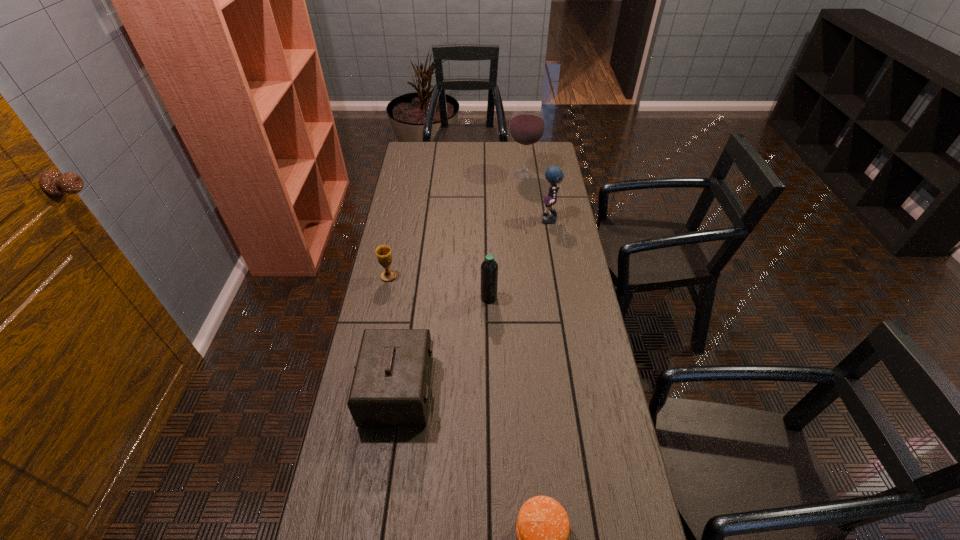
This screenshot has height=540, width=960. In order to click on blank area located 0.060m on the back of the farthest object in this screenshot , I will do `click(521, 159)`.

At what (x,y) coordinates should I click in order to perform the action: click on vacant space situated 0.220m on the front-facing side of the rag doll. Please return your answer as a coordinate pair (x, y). The width and height of the screenshot is (960, 540). Looking at the image, I should click on (489, 221).

Image resolution: width=960 pixels, height=540 pixels. Identify the location of vacant region located on the front-facing side of the rag doll. (526, 221).

Locate an element on the screen. free space located on the front-facing side of the rag doll is located at coordinates (516, 221).

Locate an element on the screen. The image size is (960, 540). free region located on the back of the fourth object from right to left is located at coordinates (489, 270).

Image resolution: width=960 pixels, height=540 pixels. In order to click on vacant region located 0.110m on the back of the second nearest object in this screenshot , I will do `click(407, 329)`.

Where is `vacant space located 0.330m on the back of the fifth tallest object`? The image size is (960, 540). vacant space located 0.330m on the back of the fifth tallest object is located at coordinates (400, 217).

You are a GUI agent. You are given a task and a screenshot of the screen. Output one action in this format:
    pyautogui.click(x=<x>, y=<y>)
    Task: Click on the object situated at the far edge
    The image size is (960, 540).
    Given the screenshot: What is the action you would take?
    pyautogui.click(x=527, y=125)

I want to click on the first-aid kit that is positioned at the left edge, so click(390, 388).

Identify the location of chalice that is at the left edge. The width and height of the screenshot is (960, 540). (383, 252).